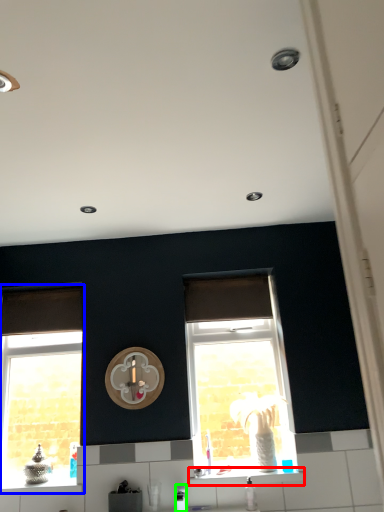
Question: Which is farther away from window sill (highlighted by a red box)? window (highlighted by a blue box) or appliance (highlighted by a green box)?

Choices:
 (A) window
 (B) appliance

Answer: (A)